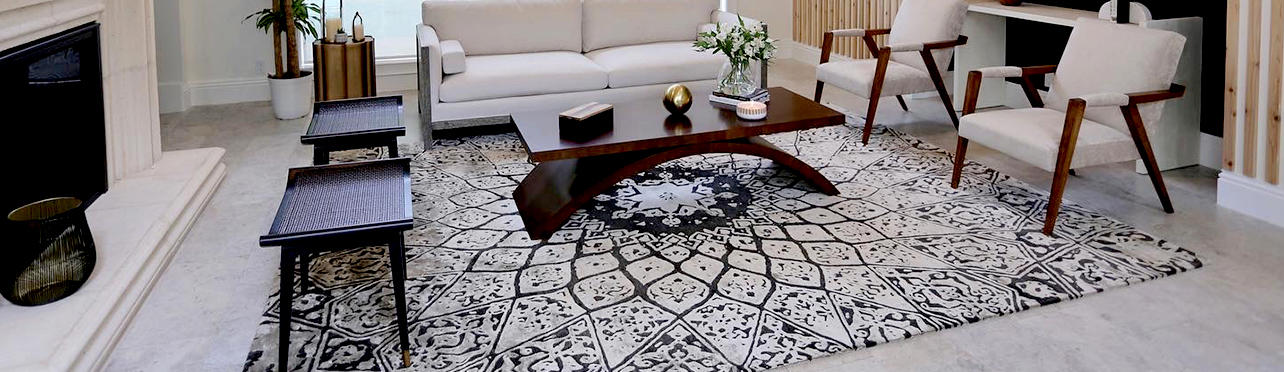
Identify the location of rug. (729, 265).